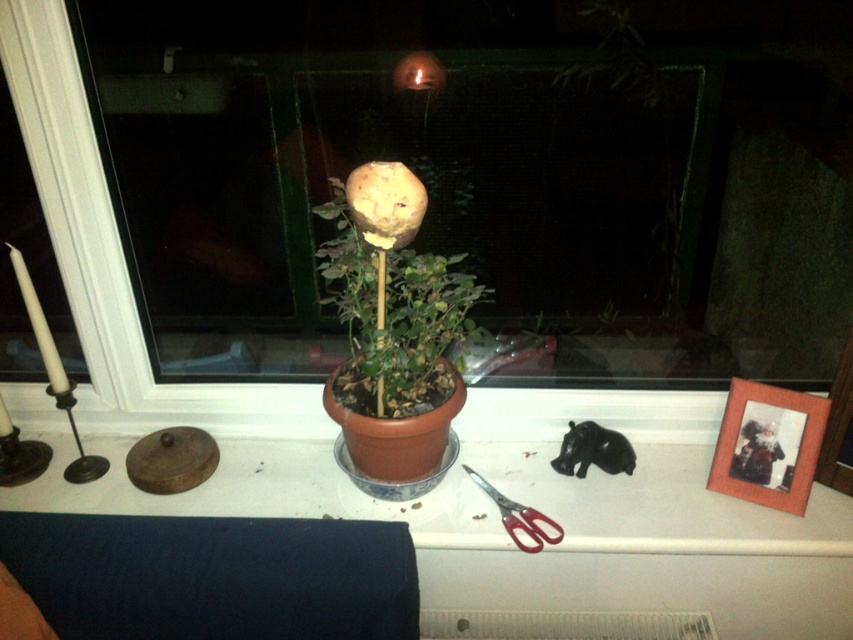
Question: Estimate the real-world distances between objects in this image. Which object is farther from the matte brown pot at center?

Choices:
 (A) transparent glass window at center
 (B) red plastic scissors at lower right

Answer: (B)

Question: Can you confirm if matte brown pot at center is wider than red plastic scissors at lower right?

Choices:
 (A) no
 (B) yes

Answer: (B)

Question: Is transparent glass window at center wider than red plastic scissors at lower right?

Choices:
 (A) yes
 (B) no

Answer: (A)

Question: Among these objects, which one is nearest to the camera?

Choices:
 (A) red plastic scissors at lower right
 (B) transparent glass window at center
 (C) matte brown pot at center

Answer: (C)

Question: Among these objects, which one is farthest from the camera?

Choices:
 (A) transparent glass window at center
 (B) matte brown pot at center

Answer: (A)

Question: Is the position of transparent glass window at center less distant than that of matte brown pot at center?

Choices:
 (A) no
 (B) yes

Answer: (A)